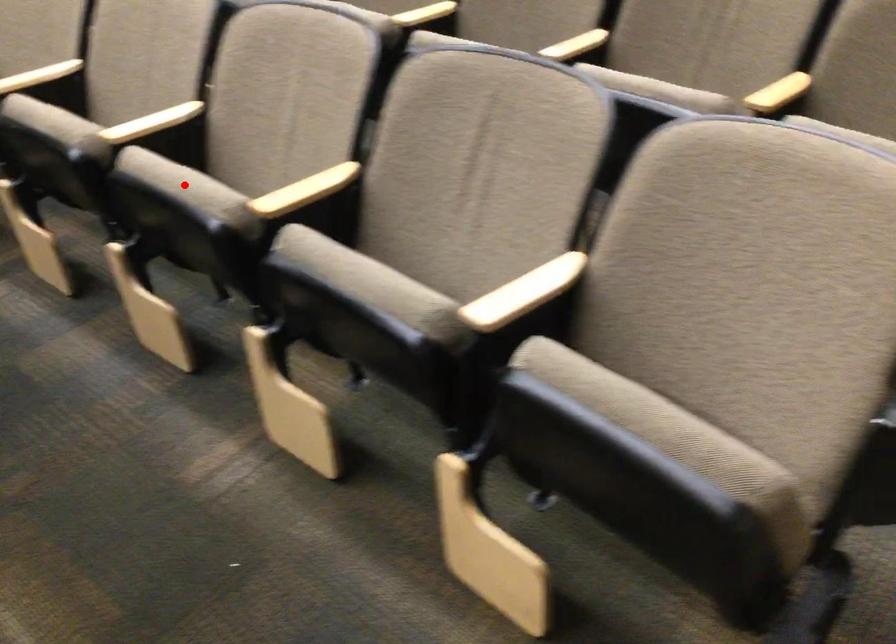
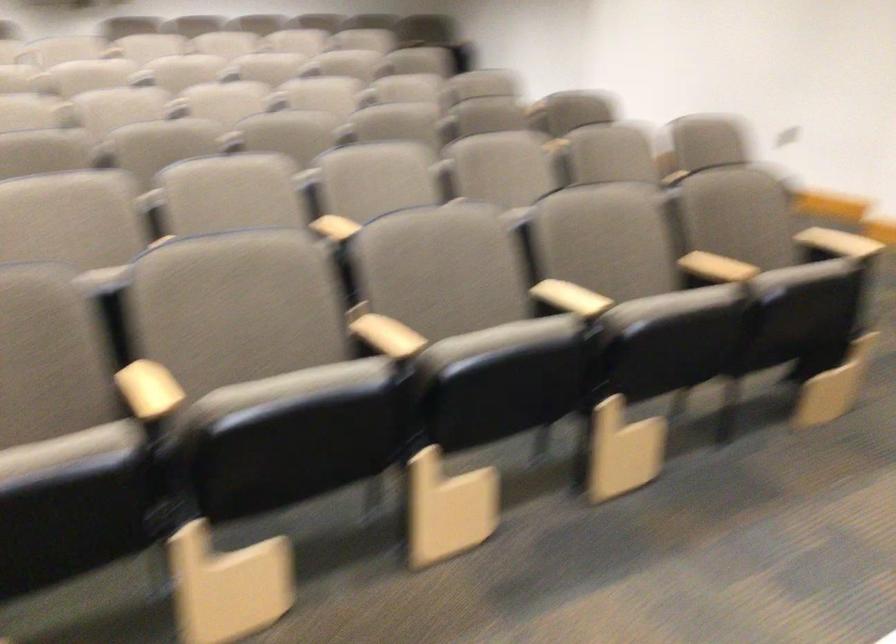
Question: I am providing you with two images of the same scene from different viewpoints. A red point is marked on the first image. Is the red point's position out of view in image 2?

Choices:
 (A) Yes
 (B) No

Answer: (A)